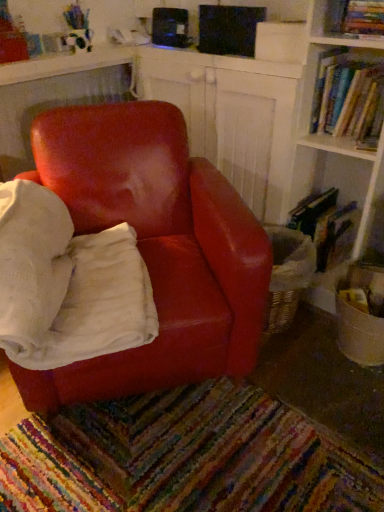
You are a GUI agent. You are given a task and a screenshot of the screen. Output one action in this format:
    pyautogui.click(x=<x>, y=<y>)
    Task: Click on the hardcover books at upper right, positioned as the 2th book in bottom-to-top order
    
    Given the screenshot: What is the action you would take?
    (x=348, y=98)

Where is `hardcover book at right, marked as the 1th book in a bottom-to-top arrangement`? hardcover book at right, marked as the 1th book in a bottom-to-top arrangement is located at coordinates (327, 226).

Describe the element at coordinates (327, 226) in the screenshot. I see `hardcover book at right, acting as the 3th book starting from the top` at that location.

Describe the element at coordinates (364, 17) in the screenshot. I see `hardcover book at upper right, the third book in the bottom-to-top sequence` at that location.

Find the location of `hardcover book at upper right, the third book in the bottom-to-top sequence`. hardcover book at upper right, the third book in the bottom-to-top sequence is located at coordinates (364, 17).

Where is `hardcover books at upper right, positioned as the 2th book in bottom-to-top order`? hardcover books at upper right, positioned as the 2th book in bottom-to-top order is located at coordinates [348, 98].

Is hardcover book at right, acting as the 3th book starting from the top, oriented towards matte leather chair at center?

Yes.

Which book is the 1st one when counting from the right side of the matte leather chair at center? Please provide its 2D coordinates.

[(327, 226)]

Can you tell me how much hardcover book at right, marked as the 1th book in a bottom-to-top arrangement, and matte leather chair at center differ in facing direction?

hardcover book at right, marked as the 1th book in a bottom-to-top arrangement, and matte leather chair at center are facing 52.7 degrees away from each other.

Which object is closer to the camera taking this photo, hardcover book at right, acting as the 3th book starting from the top, or matte leather chair at center?

matte leather chair at center.

Is hardcover book at upper right, the 1th book in the top-to-bottom sequence, not inside hardcover book at right, marked as the 1th book in a bottom-to-top arrangement?

hardcover book at upper right, the 1th book in the top-to-bottom sequence, lies outside hardcover book at right, marked as the 1th book in a bottom-to-top arrangement,'s area.

Is hardcover book at upper right, the third book in the bottom-to-top sequence, positioned behind hardcover book at right, marked as the 1th book in a bottom-to-top arrangement?

No, hardcover book at upper right, the third book in the bottom-to-top sequence, is closer to the viewer.

From a real-world perspective, which object stands above the other?

hardcover book at upper right, the 1th book in the top-to-bottom sequence, is physically above.

Could you measure the distance between hardcover book at upper right, the third book in the bottom-to-top sequence, and matte leather chair at center?

The distance of hardcover book at upper right, the third book in the bottom-to-top sequence, from matte leather chair at center is 37.40 inches.

Is hardcover book at upper right, the third book in the bottom-to-top sequence, oriented away from matte leather chair at center?

No.

Are hardcover book at upper right, the 1th book in the top-to-bottom sequence, and matte leather chair at center located far from each other?

They are positioned close to each other.

Is hardcover book at upper right, the 1th book in the top-to-bottom sequence, not inside matte leather chair at center?

That's correct, hardcover book at upper right, the 1th book in the top-to-bottom sequence, is outside of matte leather chair at center.

In the scene shown: Is hardcover book at right, marked as the 1th book in a bottom-to-top arrangement, turned away from hardcover books at upper right, positioned as the 2th book in bottom-to-top order?

hardcover book at right, marked as the 1th book in a bottom-to-top arrangement, is not turned away from hardcover books at upper right, positioned as the 2th book in bottom-to-top order.

From a real-world perspective, which is physically below, hardcover book at right, marked as the 1th book in a bottom-to-top arrangement, or hardcover books at upper right, positioned as the 2th book in bottom-to-top order?

hardcover book at right, marked as the 1th book in a bottom-to-top arrangement, from a real-world perspective.

Locate an element on the screen. The image size is (384, 512). the 2nd book to the right of the hardcover book at right, marked as the 1th book in a bottom-to-top arrangement, counting from the anchor's position is located at coordinates (348, 98).

Between hardcover book at right, acting as the 3th book starting from the top, and hardcover books at upper right, the 2th book in the top-to-bottom sequence, which one appears on the right side from the viewer's perspective?

Positioned to the right is hardcover books at upper right, the 2th book in the top-to-bottom sequence.

How many degrees apart are the facing directions of hardcover books at upper right, the 2th book in the top-to-bottom sequence, and matte leather chair at center?

The facing directions of hardcover books at upper right, the 2th book in the top-to-bottom sequence, and matte leather chair at center are 52.7 degrees apart.

Does hardcover books at upper right, the 2th book in the top-to-bottom sequence, have a smaller size compared to matte leather chair at center?

Yes, hardcover books at upper right, the 2th book in the top-to-bottom sequence, is smaller than matte leather chair at center.

From a real-world perspective, which book is the 1st one above the matte leather chair at center? Please provide its 2D coordinates.

[(348, 98)]

Does hardcover books at upper right, the 2th book in the top-to-bottom sequence, come in front of matte leather chair at center?

No, it is behind matte leather chair at center.

From the picture: Considering the relative positions of hardcover books at upper right, positioned as the 2th book in bottom-to-top order, and hardcover book at right, acting as the 3th book starting from the top, in the image provided, is hardcover books at upper right, positioned as the 2th book in bottom-to-top order, to the left or to the right of hardcover book at right, acting as the 3th book starting from the top,?

From the image, it's evident that hardcover books at upper right, positioned as the 2th book in bottom-to-top order, is to the right of hardcover book at right, acting as the 3th book starting from the top.

Is hardcover books at upper right, positioned as the 2th book in bottom-to-top order, bigger than hardcover book at right, acting as the 3th book starting from the top?

Actually, hardcover books at upper right, positioned as the 2th book in bottom-to-top order, might be smaller than hardcover book at right, acting as the 3th book starting from the top.

The width and height of the screenshot is (384, 512). What are the coordinates of `book lying behind the hardcover books at upper right, the 2th book in the top-to-bottom sequence` in the screenshot? It's located at (327, 226).

Is hardcover books at upper right, the 2th book in the top-to-bottom sequence, closer to camera compared to hardcover book at right, acting as the 3th book starting from the top?

Yes.

Which is more to the right, hardcover book at upper right, the third book in the bottom-to-top sequence, or hardcover books at upper right, positioned as the 2th book in bottom-to-top order?

hardcover books at upper right, positioned as the 2th book in bottom-to-top order, is more to the right.

Is hardcover book at upper right, the 1th book in the top-to-bottom sequence, inside the boundaries of hardcover books at upper right, the 2th book in the top-to-bottom sequence, or outside?

hardcover book at upper right, the 1th book in the top-to-bottom sequence, cannot be found inside hardcover books at upper right, the 2th book in the top-to-bottom sequence.

Considering the sizes of objects hardcover book at upper right, the third book in the bottom-to-top sequence, and hardcover books at upper right, the 2th book in the top-to-bottom sequence, in the image provided, who is bigger, hardcover book at upper right, the third book in the bottom-to-top sequence, or hardcover books at upper right, the 2th book in the top-to-bottom sequence,?

hardcover books at upper right, the 2th book in the top-to-bottom sequence.

Considering the positions of points (368, 12) and (368, 126), is point (368, 12) closer to camera compared to point (368, 126)?

Yes, point (368, 12) is in front of point (368, 126).

This screenshot has width=384, height=512. What are the coordinates of `the 1st book to the right of the matte leather chair at center, starting your count from the anchor` in the screenshot? It's located at (327, 226).

At what (x,y) coordinates should I click in order to perform the action: click on the 2nd book behind the hardcover book at upper right, the 1th book in the top-to-bottom sequence, counting from the anchor's position. Please return your answer as a coordinate pair (x, y). This screenshot has width=384, height=512. Looking at the image, I should click on (327, 226).

Estimate the real-world distances between objects in this image. Which object is further from matte leather chair at center, hardcover book at upper right, the 1th book in the top-to-bottom sequence, or hardcover books at upper right, the 2th book in the top-to-bottom sequence?

The object further to matte leather chair at center is hardcover book at upper right, the 1th book in the top-to-bottom sequence.

From the picture: From the image, which object appears to be farther from matte leather chair at center, hardcover book at right, acting as the 3th book starting from the top, or hardcover book at upper right, the third book in the bottom-to-top sequence?

hardcover book at upper right, the third book in the bottom-to-top sequence, is positioned further to the anchor matte leather chair at center.

When comparing their distances from hardcover books at upper right, the 2th book in the top-to-bottom sequence, does matte leather chair at center or hardcover book at right, marked as the 1th book in a bottom-to-top arrangement, seem further?

The object further to hardcover books at upper right, the 2th book in the top-to-bottom sequence, is matte leather chair at center.

Which object lies further to the anchor point matte leather chair at center, hardcover books at upper right, the 2th book in the top-to-bottom sequence, or hardcover book at right, marked as the 1th book in a bottom-to-top arrangement?

The object further to matte leather chair at center is hardcover books at upper right, the 2th book in the top-to-bottom sequence.

Estimate the real-world distances between objects in this image. Which object is further from hardcover book at upper right, the 1th book in the top-to-bottom sequence, hardcover book at right, marked as the 1th book in a bottom-to-top arrangement, or matte leather chair at center?

matte leather chair at center lies further to hardcover book at upper right, the 1th book in the top-to-bottom sequence, than the other object.

From the image, which object appears to be farther from hardcover book at upper right, the 1th book in the top-to-bottom sequence, matte leather chair at center or hardcover books at upper right, positioned as the 2th book in bottom-to-top order?

Based on the image, matte leather chair at center appears to be further to hardcover book at upper right, the 1th book in the top-to-bottom sequence.

Considering their positions, is hardcover book at upper right, the third book in the bottom-to-top sequence, positioned further to hardcover books at upper right, the 2th book in the top-to-bottom sequence, than matte leather chair at center?

matte leather chair at center is positioned further to the anchor hardcover books at upper right, the 2th book in the top-to-bottom sequence.

When comparing their distances from hardcover books at upper right, positioned as the 2th book in bottom-to-top order, does hardcover book at right, marked as the 1th book in a bottom-to-top arrangement, or matte leather chair at center seem further?

matte leather chair at center lies further to hardcover books at upper right, positioned as the 2th book in bottom-to-top order, than the other object.

Find the location of a particular element. book located between matte leather chair at center and hardcover book at upper right, the third book in the bottom-to-top sequence, in the left-right direction is located at coordinates (327, 226).

Locate an element on the screen. The width and height of the screenshot is (384, 512). book between hardcover book at upper right, the third book in the bottom-to-top sequence, and hardcover book at right, acting as the 3th book starting from the top, from top to bottom is located at coordinates coord(348,98).